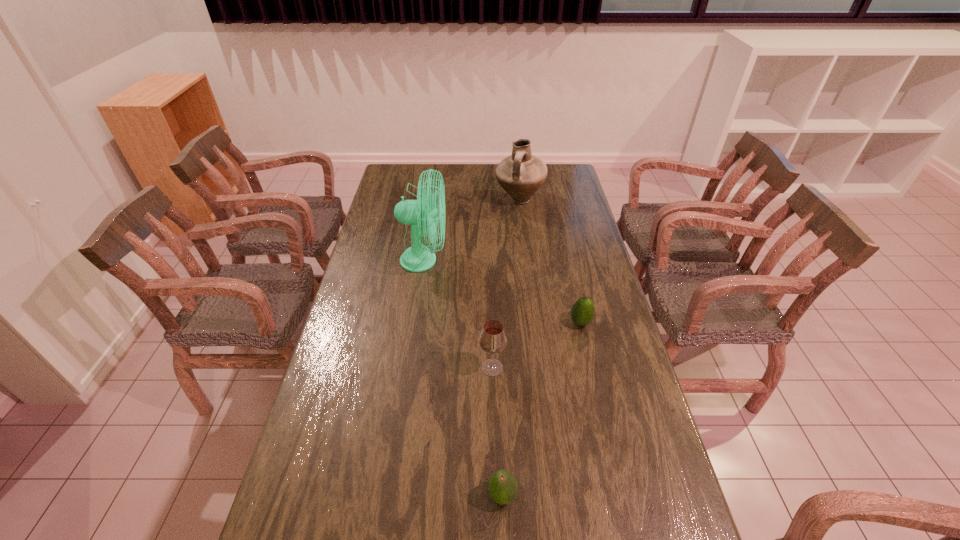
You are a GUI agent. You are given a task and a screenshot of the screen. Output one action in this format:
    pyautogui.click(x=<x>, y=<y>)
    Task: Click on the tallest object
    This screenshot has height=540, width=960.
    Given the screenshot: What is the action you would take?
    pyautogui.click(x=417, y=258)

What are the coordinates of `the leftmost object` in the screenshot? It's located at (417, 258).

Image resolution: width=960 pixels, height=540 pixels. What are the coordinates of `the farthest object` in the screenshot? It's located at (521, 174).

What are the coordinates of `pitcher` in the screenshot? It's located at (521, 174).

The image size is (960, 540). I want to click on the third tallest object, so click(493, 339).

This screenshot has height=540, width=960. What are the coordinates of `wineglass` in the screenshot? It's located at (493, 339).

Locate an element on the screen. Image resolution: width=960 pixels, height=540 pixels. the right avocado is located at coordinates (582, 312).

Where is `the farther avocado`? This screenshot has height=540, width=960. the farther avocado is located at coordinates (582, 312).

I want to click on the left avocado, so click(502, 485).

The width and height of the screenshot is (960, 540). I want to click on the nearest object, so click(x=502, y=485).